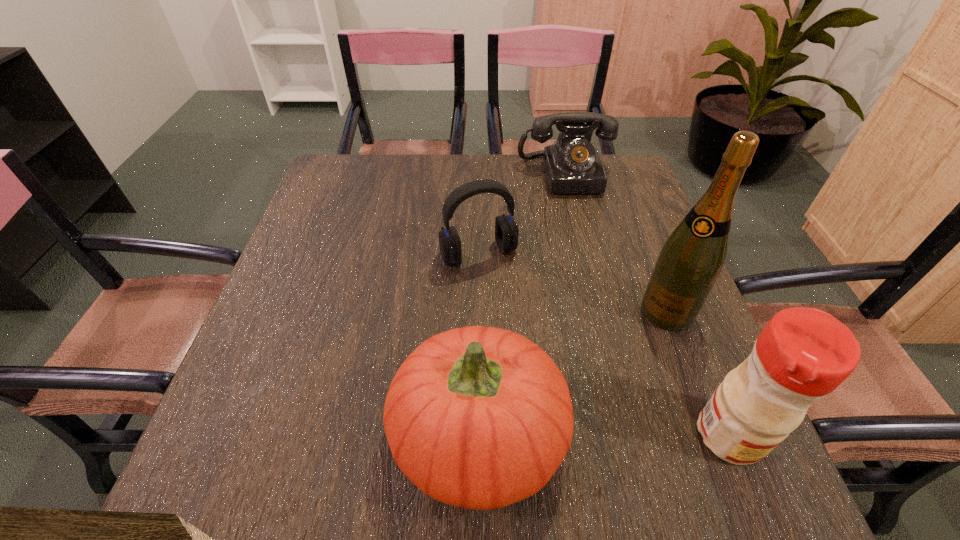
Find the location of `the third shortest object`. the third shortest object is located at coordinates (478, 417).

This screenshot has width=960, height=540. In order to click on the second tallest object in this screenshot , I will do point(803,354).

This screenshot has width=960, height=540. Find the location of `the shortest object`. the shortest object is located at coordinates (572, 165).

Find the location of `telephone`. telephone is located at coordinates (572, 165).

Find the location of a particular element. This screenshot has height=540, width=960. the fourth nearest object is located at coordinates (506, 229).

This screenshot has height=540, width=960. I want to click on the third nearest object, so click(x=690, y=261).

Identify the location of the tallest object. The height and width of the screenshot is (540, 960). (690, 261).

Image resolution: width=960 pixels, height=540 pixels. Identify the location of vacant area situated on the back of the pumpkin. (479, 291).

Locate an element on the screen. This screenshot has width=960, height=540. vacant space located on the left of the condiment is located at coordinates (574, 435).

The image size is (960, 540). I want to click on vacant region located 0.330m on the dial of the telephone, so click(x=594, y=282).